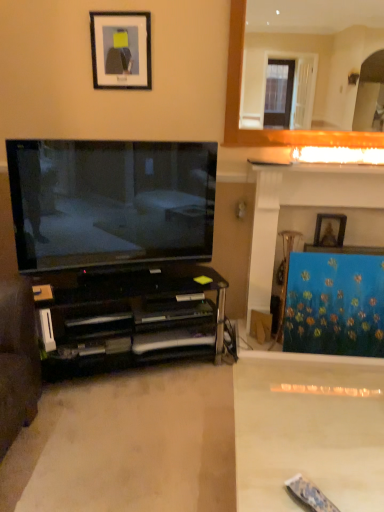
You are a GUI agent. You are given a task and a screenshot of the screen. Output one action in this format:
    pyautogui.click(x=<x>, y=<y>)
    Task: Click on the white glossy plain at lower right
    The height and width of the screenshot is (512, 384).
    Given the screenshot: What is the action you would take?
    pyautogui.click(x=309, y=429)

You are a GUI agent. You are given a task and a screenshot of the screen. Output one action in this format:
    pyautogui.click(x=<x>, y=<y>)
    Task: Click on the black matte picture frame at upper center, the second picture frame viewed from the right
    This screenshot has width=384, height=512.
    Given the screenshot: What is the action you would take?
    pyautogui.click(x=121, y=50)

What do you see at coordinates (330, 230) in the screenshot? The height and width of the screenshot is (512, 384). I see `wooden picture frame at upper right, which is the 2th picture frame in front-to-back order` at bounding box center [330, 230].

At what (x,y) coordinates should I click in order to perform the action: click on white marble fireplace at upper right. Please return your answer as a coordinate pair (x, y). Looking at the image, I should click on (273, 131).

What are the coordinates of `blue textured curtain at right` in the screenshot? It's located at (335, 304).

What's the angular difference between wooden picture frame at upper right, acting as the 1th picture frame starting from the back, and matte black tv at left's facing directions?

The angle between the facing direction of wooden picture frame at upper right, acting as the 1th picture frame starting from the back, and the facing direction of matte black tv at left is 22.2 degrees.

Is wooden picture frame at upper right, the 2th picture frame viewed from the left, in contact with matte black tv at left?

No, wooden picture frame at upper right, the 2th picture frame viewed from the left, is not next to matte black tv at left.

Can you confirm if wooden picture frame at upper right, acting as the 1th picture frame starting from the back, is shorter than matte black tv at left?

Yes.

Between wooden picture frame at upper right, the 2th picture frame viewed from the left, and matte black tv at left, which one appears on the right side from the viewer's perspective?

Positioned to the right is wooden picture frame at upper right, the 2th picture frame viewed from the left.

From a real-world perspective, is black glass cabinet at left located beneath white glossy plain at lower right?

Actually, black glass cabinet at left is physically above white glossy plain at lower right in the real world.

Which of these two, black glass cabinet at left or white glossy plain at lower right, is thinner?

Thinner between the two is black glass cabinet at left.

From the picture: Would you say black glass cabinet at left is to the left or to the right of white glossy plain at lower right in the picture?

From the image, it's evident that black glass cabinet at left is to the left of white glossy plain at lower right.

Would you consider black glass cabinet at left to be distant from white glossy plain at lower right?

No, black glass cabinet at left is not far away from white glossy plain at lower right.

In the image, is black matte picture frame at upper center, which is the second picture frame from back to front, positioned in front of or behind white glossy plain at lower right?

Clearly, black matte picture frame at upper center, which is the second picture frame from back to front, is behind white glossy plain at lower right.

Are black matte picture frame at upper center, the 1th picture frame from the left, and white glossy plain at lower right far apart?

Yes, black matte picture frame at upper center, the 1th picture frame from the left, and white glossy plain at lower right are quite far apart.

From the image's perspective, is black matte picture frame at upper center, arranged as the first picture frame when viewed from the front, over white glossy plain at lower right?

Indeed, from the image's perspective, black matte picture frame at upper center, arranged as the first picture frame when viewed from the front, is shown above white glossy plain at lower right.

Considering the sizes of objects black matte picture frame at upper center, which is counted as the 1th picture frame, starting from the top, and wooden picture frame at upper right, which is the 2th picture frame in front-to-back order, in the image provided, who is thinner, black matte picture frame at upper center, which is counted as the 1th picture frame, starting from the top, or wooden picture frame at upper right, which is the 2th picture frame in front-to-back order,?

black matte picture frame at upper center, which is counted as the 1th picture frame, starting from the top.

From the image's perspective, which is above, black matte picture frame at upper center, the second picture frame viewed from the right, or wooden picture frame at upper right, acting as the 1th picture frame starting from the back?

black matte picture frame at upper center, the second picture frame viewed from the right.

From a real-world perspective, which is physically above, black matte picture frame at upper center, the second picture frame viewed from the right, or wooden picture frame at upper right, acting as the 1th picture frame starting from the back?

In real-world perspective, black matte picture frame at upper center, the second picture frame viewed from the right, is above.

Is black matte picture frame at upper center, which is the second picture frame from back to front, taller or shorter than wooden picture frame at upper right, which is the second picture frame from top to bottom?

In the image, black matte picture frame at upper center, which is the second picture frame from back to front, appears to be taller than wooden picture frame at upper right, which is the second picture frame from top to bottom.

Which object is more forward, matte black tv at left or white marble fireplace at upper right?

matte black tv at left is in front.

Is point (200, 237) farther from viewer compared to point (236, 22)?

Yes, it is.

Is matte black tv at left in contact with white marble fireplace at upper right?

No, matte black tv at left is not making contact with white marble fireplace at upper right.

At what (x,y) coordinates should I click in order to perform the action: click on cabinetry below the matte black tv at left (from the image's perspective). Please return your answer as a coordinate pair (x, y). This screenshot has width=384, height=512. Looking at the image, I should click on (128, 318).

Considering the relative positions of matte black tv at left and black glass cabinet at left in the image provided, is matte black tv at left to the left or to the right of black glass cabinet at left?

matte black tv at left is to the right of black glass cabinet at left.

Is matte black tv at left spatially inside black glass cabinet at left, or outside of it?

The correct answer is: outside.

In terms of size, does black glass cabinet at left appear bigger or smaller than matte black tv at left?

Clearly, black glass cabinet at left is larger in size than matte black tv at left.

Locate an element on the screen. The width and height of the screenshot is (384, 512). television lying above the black glass cabinet at left (from the image's perspective) is located at coordinates (110, 202).

Is black glass cabinet at left turned away from matte black tv at left?

black glass cabinet at left does not have its back to matte black tv at left.

Is point (97, 364) farther from camera compared to point (135, 185)?

Yes, it is.

Image resolution: width=384 pixels, height=512 pixels. What are the coordinates of `picture frame on the right of matte black tv at left` in the screenshot? It's located at (330, 230).

Identify the location of plain that appears below the black glass cabinet at left (from the image's perspective). The image size is (384, 512). click(309, 429).

Which object lies nearer to the anchor point matte black tv at left, white marble fireplace at upper right or black glass cabinet at left?

black glass cabinet at left is closer to matte black tv at left.

Which object lies nearer to the anchor point white marble fireplace at upper right, white glossy plain at lower right or wooden picture frame at upper right, the 2th picture frame viewed from the left?

The object closer to white marble fireplace at upper right is wooden picture frame at upper right, the 2th picture frame viewed from the left.

Which object lies further to the anchor point wooden picture frame at upper right, placed as the 1th picture frame when sorted from right to left, matte black tv at left or black matte picture frame at upper center, which is the second picture frame from back to front?

Based on the image, black matte picture frame at upper center, which is the second picture frame from back to front, appears to be further to wooden picture frame at upper right, placed as the 1th picture frame when sorted from right to left.

Looking at this image, which object lies further to the anchor point white marble fireplace at upper right, white glossy plain at lower right or blue textured curtain at right?

Among the two, white glossy plain at lower right is located further to white marble fireplace at upper right.

Looking at the image, which one is located closer to black matte picture frame at upper center, which is counted as the 1th picture frame, starting from the top, white glossy plain at lower right or white marble fireplace at upper right?

white marble fireplace at upper right is closer to black matte picture frame at upper center, which is counted as the 1th picture frame, starting from the top.

Which object lies further to the anchor point white marble fireplace at upper right, wooden picture frame at upper right, acting as the 1th picture frame starting from the back, or black matte picture frame at upper center, the 1th picture frame from the left?

black matte picture frame at upper center, the 1th picture frame from the left, lies further to white marble fireplace at upper right than the other object.

Considering their positions, is blue textured curtain at right positioned further to wooden picture frame at upper right, which is the second picture frame from top to bottom, than matte black tv at left?

Among the two, matte black tv at left is located further to wooden picture frame at upper right, which is the second picture frame from top to bottom.

When comparing their distances from black matte picture frame at upper center, which appears as the second picture frame when ordered from the bottom, does white glossy plain at lower right or blue textured curtain at right seem closer?

blue textured curtain at right is closer to black matte picture frame at upper center, which appears as the second picture frame when ordered from the bottom.

At what (x,y) coordinates should I click in order to perform the action: click on picture frame between white marble fireplace at upper right and black glass cabinet at left in the up-down direction. Please return your answer as a coordinate pair (x, y). The image size is (384, 512). Looking at the image, I should click on (330, 230).

Locate an element on the screen. television that lies between black matte picture frame at upper center, which appears as the second picture frame when ordered from the bottom, and white glossy plain at lower right from top to bottom is located at coordinates (110, 202).

This screenshot has width=384, height=512. Identify the location of curtain between black matte picture frame at upper center, the 1th picture frame from the left, and black glass cabinet at left vertically. (335, 304).

Locate an element on the screen. Image resolution: width=384 pixels, height=512 pixels. picture frame between white marble fireplace at upper right and blue textured curtain at right in the vertical direction is located at coordinates (330, 230).